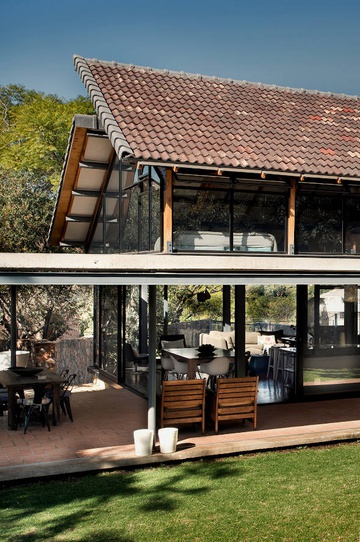
You are a GUI agent. You are given a task and a screenshot of the screen. Output one action in this format:
    pyautogui.click(x=<x>, y=<y>)
    Task: Click on the table
    Image resolution: width=360 pixels, height=542 pixels.
    Given the screenshot: What is the action you would take?
    pyautogui.click(x=181, y=353), pyautogui.click(x=13, y=380)